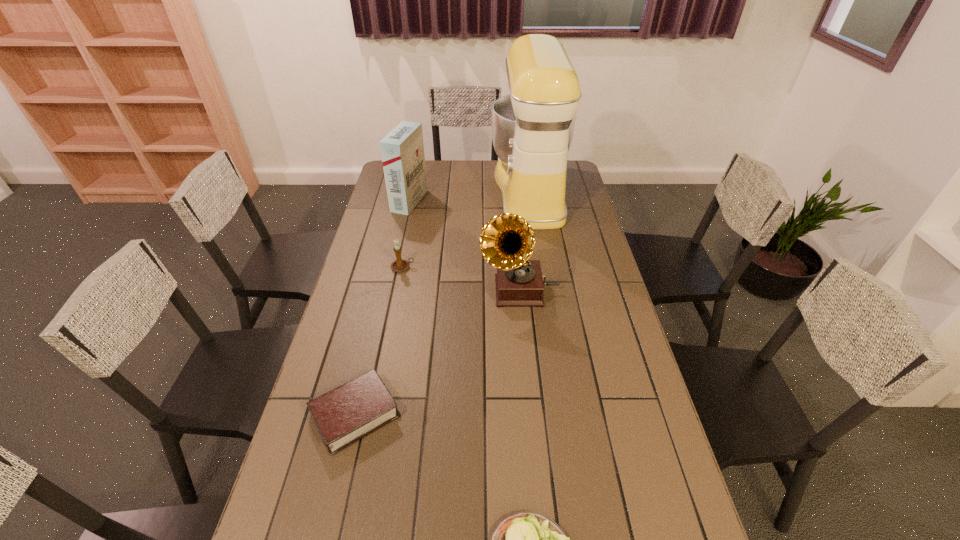
What are the coordinates of `free location that satisfies the following two spatial constraints: 1. on the side of the third shortest object with the handle; 2. on the front side of the shortest object` in the screenshot? It's located at (373, 414).